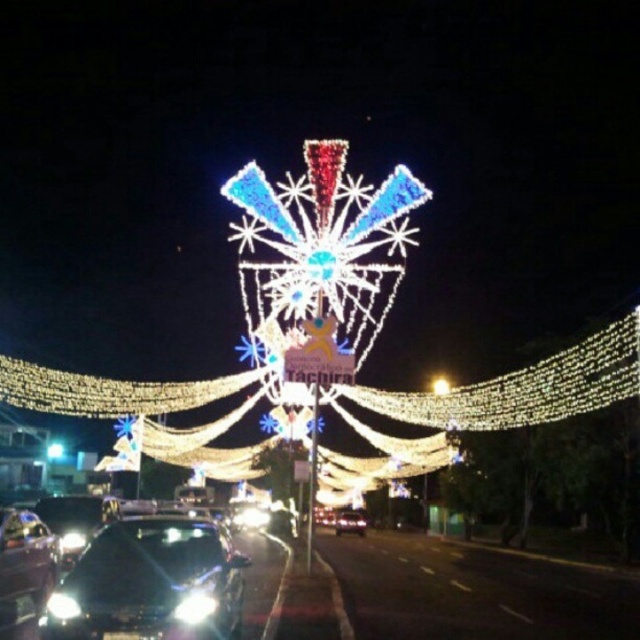
In the scene shown: Can you confirm if illuminated lights at center is wider than shiny black car at lower left?

Yes.

What do you see at coordinates (490, 403) in the screenshot? I see `illuminated lights at center` at bounding box center [490, 403].

This screenshot has width=640, height=640. In order to click on illuminated lights at center in this screenshot , I will do `click(490, 403)`.

Looking at this image, between shiny black car at lower left and illuminated starburst at center, which one has more height?

Standing taller between the two is shiny black car at lower left.

Does shiny black car at lower left appear over illuminated starburst at center?

No, shiny black car at lower left is not above illuminated starburst at center.

Image resolution: width=640 pixels, height=640 pixels. Describe the element at coordinates (24, 572) in the screenshot. I see `shiny black car at lower left` at that location.

I want to click on shiny black car at lower left, so click(x=24, y=572).

Is illuminated lights at center taller than glossy black car at center?

Correct, illuminated lights at center is much taller as glossy black car at center.

Does illuminated lights at center have a smaller size compared to glossy black car at center?

No.

Image resolution: width=640 pixels, height=640 pixels. What are the coordinates of `illuminated lights at center` in the screenshot? It's located at (490, 403).